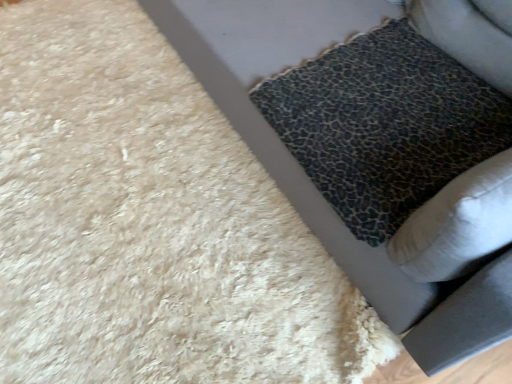
You are a GUI agent. You are given a task and a screenshot of the screen. Output one action in this format:
    pyautogui.click(x=<x>, y=<y>)
    Task: Click on the leopard print cushion at lower right
    
    Given the screenshot: What is the action you would take?
    click(x=384, y=124)

What do you see at coordinates (384, 124) in the screenshot? This screenshot has height=384, width=512. I see `leopard print cushion at lower right` at bounding box center [384, 124].

Measure the distance between leopard print cushion at lower right and camera.

leopard print cushion at lower right is 38.47 inches away from camera.

Find the location of a particular element. This screenshot has height=384, width=512. leather-textured cushion at lower right is located at coordinates (307, 177).

Describe the element at coordinates (307, 177) in the screenshot. This screenshot has width=512, height=384. I see `leather-textured cushion at lower right` at that location.

Locate an element on the screen. The height and width of the screenshot is (384, 512). leopard print cushion at lower right is located at coordinates (384, 124).

In the image, is leopard print cushion at lower right on the left side or the right side of leather-textured cushion at lower right?

leopard print cushion at lower right is to the right of leather-textured cushion at lower right.

Which is behind, leopard print cushion at lower right or leather-textured cushion at lower right?

Positioned behind is leopard print cushion at lower right.

Does point (407, 146) come closer to viewer compared to point (368, 1)?

Yes, it is.

From the image's perspective, does leopard print cushion at lower right appear lower than leather-textured cushion at lower right?

Yes.

From a real-world perspective, is leopard print cushion at lower right located higher than leather-textured cushion at lower right?

Actually, leopard print cushion at lower right is physically below leather-textured cushion at lower right in the real world.

Does leopard print cushion at lower right have a greater width compared to leather-textured cushion at lower right?

No.

Does leopard print cushion at lower right have a lesser height compared to leather-textured cushion at lower right?

Yes.

In terms of size, does leopard print cushion at lower right appear bigger or smaller than leather-textured cushion at lower right?

leopard print cushion at lower right is smaller than leather-textured cushion at lower right.

Would you say leopard print cushion at lower right contains leather-textured cushion at lower right?

No, leather-textured cushion at lower right is not a part of leopard print cushion at lower right.

Can you see leopard print cushion at lower right touching leather-textured cushion at lower right?

leopard print cushion at lower right is not next to leather-textured cushion at lower right, and they're not touching.

Is leopard print cushion at lower right looking in the opposite direction of leather-textured cushion at lower right?

Yes, leopard print cushion at lower right is facing away from leather-textured cushion at lower right.

Can you tell me how much leopard print cushion at lower right and leather-textured cushion at lower right differ in facing direction?

1.27 degrees.

How far apart are leopard print cushion at lower right and leather-textured cushion at lower right?

leopard print cushion at lower right and leather-textured cushion at lower right are 8.25 inches apart.

Where is `pillow lying behind the leather-textured cushion at lower right`? pillow lying behind the leather-textured cushion at lower right is located at coordinates (384, 124).

Which object is positioned more to the left, leather-textured cushion at lower right or leopard print cushion at lower right?

Positioned to the left is leather-textured cushion at lower right.

Does leather-textured cushion at lower right lie behind leopard print cushion at lower right?

No, it is in front of leopard print cushion at lower right.

Is point (322, 202) less distant than point (257, 107)?

Yes, it is.

From the picture: From the image's perspective, which is above, leather-textured cushion at lower right or leopard print cushion at lower right?

From the image's view, leather-textured cushion at lower right is above.

From a real-world perspective, is leather-textured cushion at lower right physically below leopard print cushion at lower right?

No, from a real-world perspective, leather-textured cushion at lower right is not beneath leopard print cushion at lower right.

Does leather-textured cushion at lower right have a greater width compared to leopard print cushion at lower right?

Correct, the width of leather-textured cushion at lower right exceeds that of leopard print cushion at lower right.

Is leather-textured cushion at lower right taller or shorter than leopard print cushion at lower right?

Considering their sizes, leather-textured cushion at lower right has more height than leopard print cushion at lower right.

Considering the relative sizes of leather-textured cushion at lower right and leopard print cushion at lower right in the image provided, is leather-textured cushion at lower right bigger than leopard print cushion at lower right?

Yes.

Is leopard print cushion at lower right surrounded by leather-textured cushion at lower right?

Yes, leopard print cushion at lower right can be found within leather-textured cushion at lower right.

Can you see leather-textured cushion at lower right touching leopard print cushion at lower right?

No, leather-textured cushion at lower right is not making contact with leopard print cushion at lower right.

Could you tell me if leather-textured cushion at lower right is facing leopard print cushion at lower right?

Yes.

In order to click on furniture lying above the leopard print cushion at lower right (from the image's perspective) in this screenshot , I will do `click(307, 177)`.

Where is `furniture above the leopard print cushion at lower right (from the image's perspective)`? Image resolution: width=512 pixels, height=384 pixels. furniture above the leopard print cushion at lower right (from the image's perspective) is located at coordinates (307, 177).

Identify the location of furniture in front of the leopard print cushion at lower right. (307, 177).